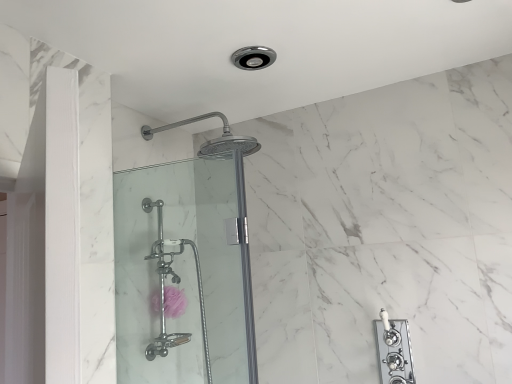
Question: Is point (214, 251) closer or farther from the camera than point (168, 291)?

Choices:
 (A) closer
 (B) farther

Answer: (B)

Question: From the image's perspective, relative to pink sponge at lower center, is clear glass shower door at center above or below?

Choices:
 (A) below
 (B) above

Answer: (B)

Question: In terms of width, does clear glass shower door at center look wider or thinner when compared to pink sponge at lower center?

Choices:
 (A) wide
 (B) thin

Answer: (B)

Question: Is pink sponge at lower center inside the boundaries of clear glass shower door at center, or outside?

Choices:
 (A) outside
 (B) inside

Answer: (A)

Question: In terms of width, does pink sponge at lower center look wider or thinner when compared to clear glass shower door at center?

Choices:
 (A) wide
 (B) thin

Answer: (A)

Question: Considering the positions of pink sponge at lower center and clear glass shower door at center in the image, is pink sponge at lower center taller or shorter than clear glass shower door at center?

Choices:
 (A) tall
 (B) short

Answer: (B)

Question: From the image's perspective, is pink sponge at lower center positioned above or below clear glass shower door at center?

Choices:
 (A) above
 (B) below

Answer: (B)